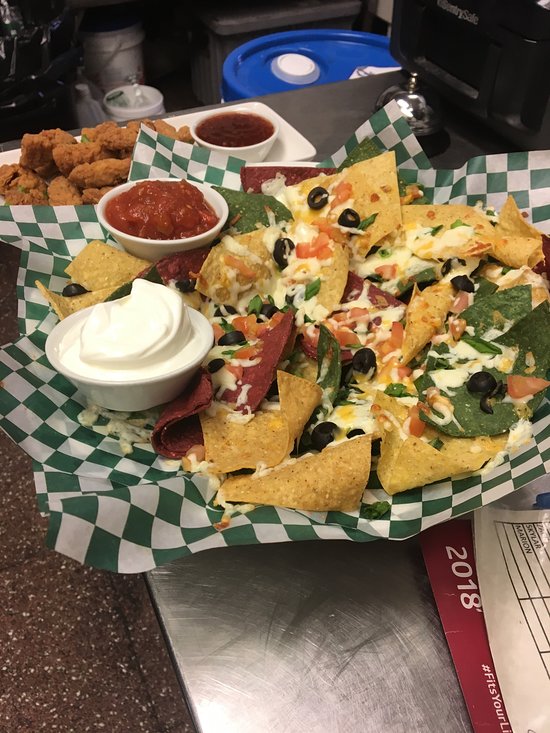
You are a GUI agent. You are given a task and a screenshot of the screen. Output one action in this format:
    pyautogui.click(x=<x>, y=<y>)
    Task: Click on the steel countertop
    This screenshot has width=550, height=733.
    Given the screenshot: What is the action you would take?
    click(x=339, y=616)